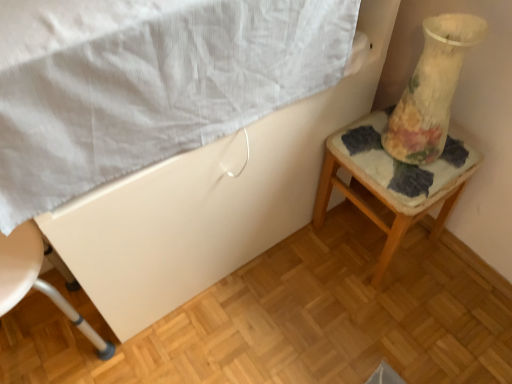
Where is `vacant space in front of floral fabric cushion at right`? The image size is (512, 384). vacant space in front of floral fabric cushion at right is located at coordinates (394, 324).